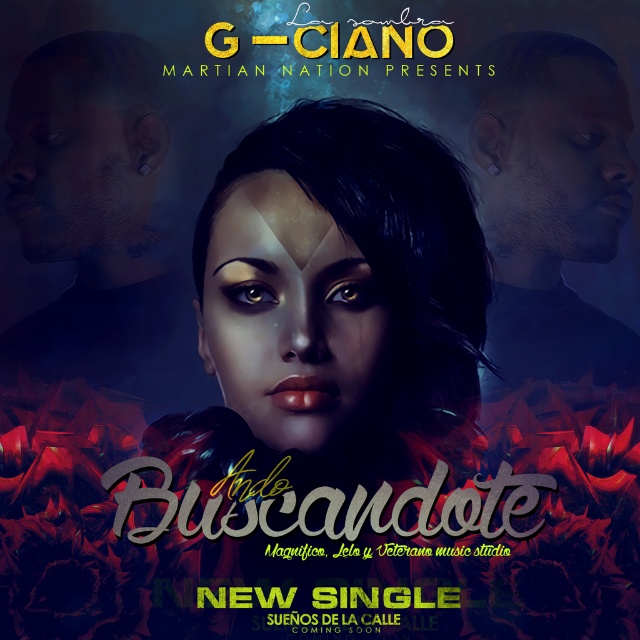
Between point (147, 268) and point (518, 316), which one is positioned in front?

Point (518, 316) is in front.

Does matte black face at center come behind matte black face at upper right?

Yes.

Between point (13, 86) and point (564, 186), which one is positioned in front?

Point (13, 86) is in front.

Identify the location of matte black face at center. The image size is (640, 640). (99, 221).